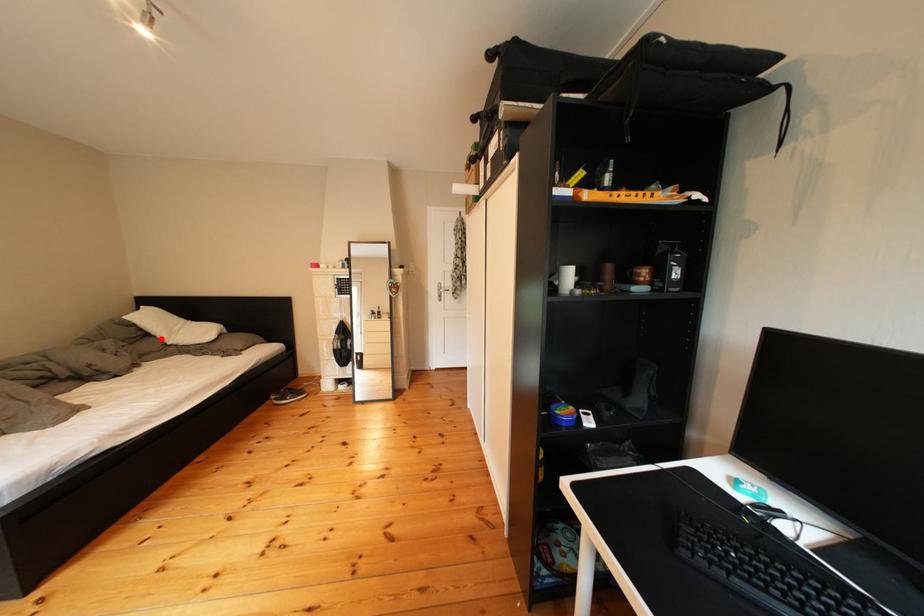
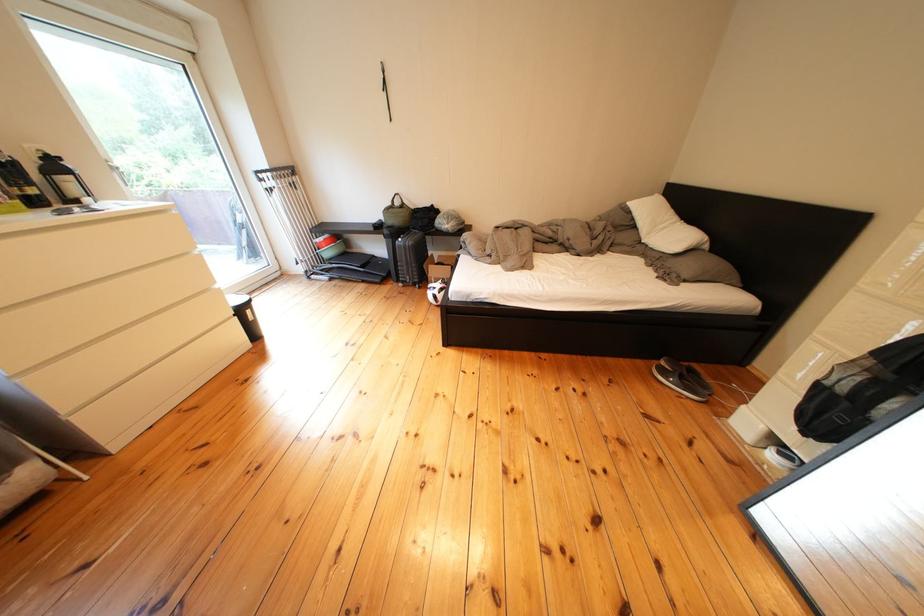
Question: I am providing you with two images of the same scene from different viewpoints. A red point is marked on the first image. Can you still see the location of the red point in image 2?

Choices:
 (A) Yes
 (B) No

Answer: (A)